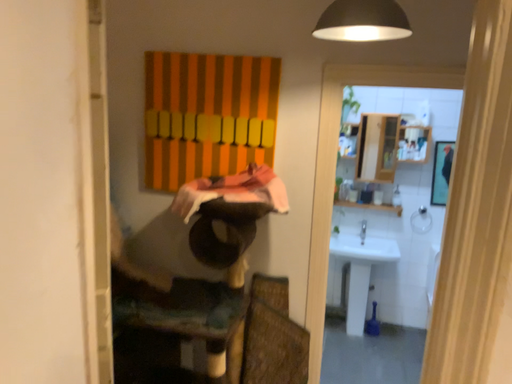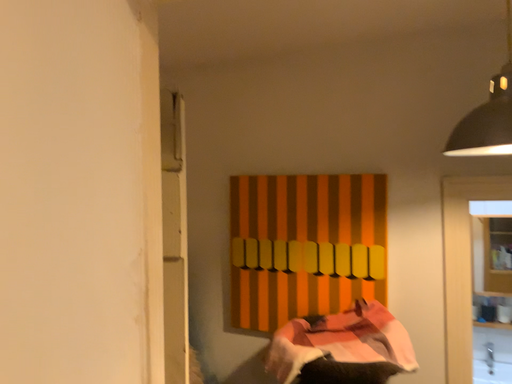
Question: How did the camera likely rotate when shooting the video?

Choices:
 (A) rotated downward
 (B) rotated upward

Answer: (B)